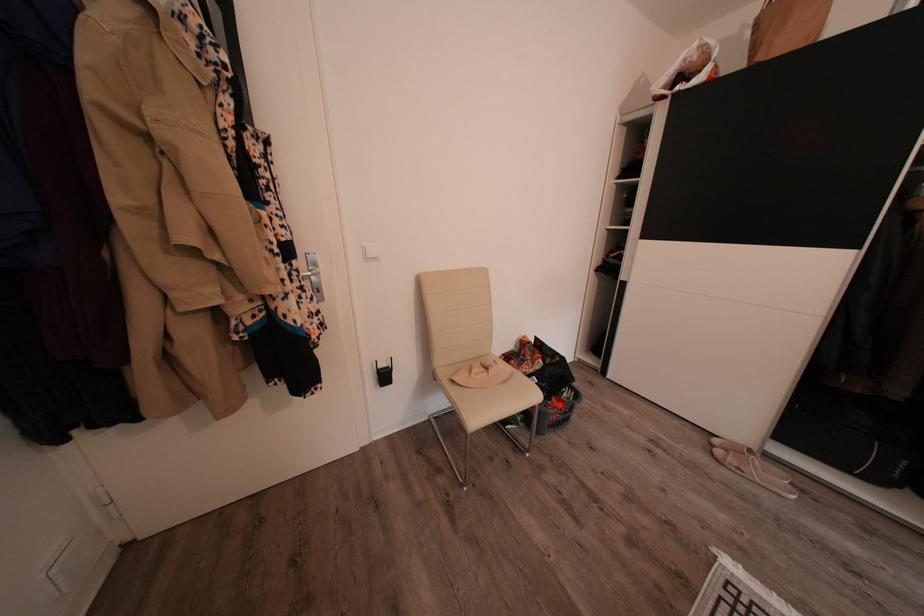
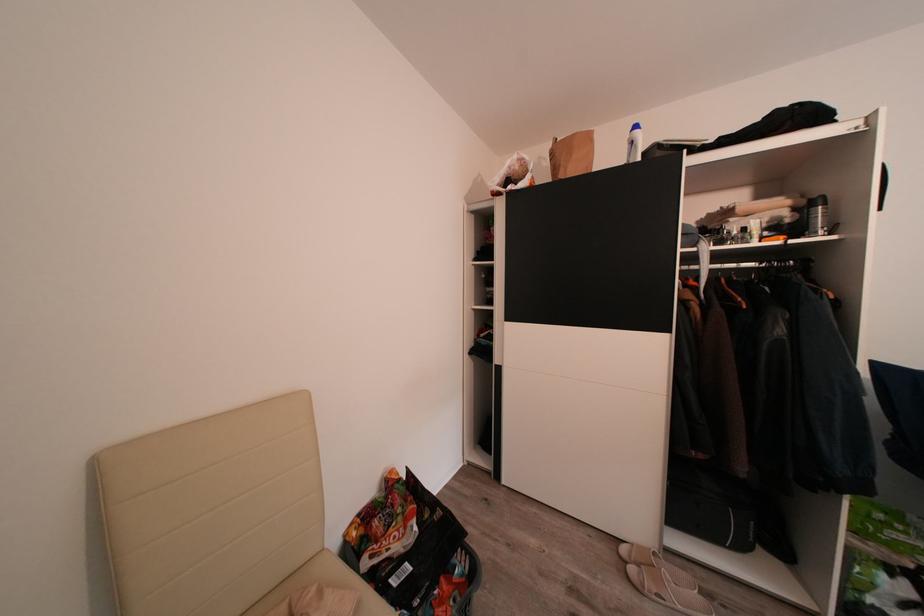
Where in the second image is the point corresponding to the highlighted location from the first image?

(446, 589)